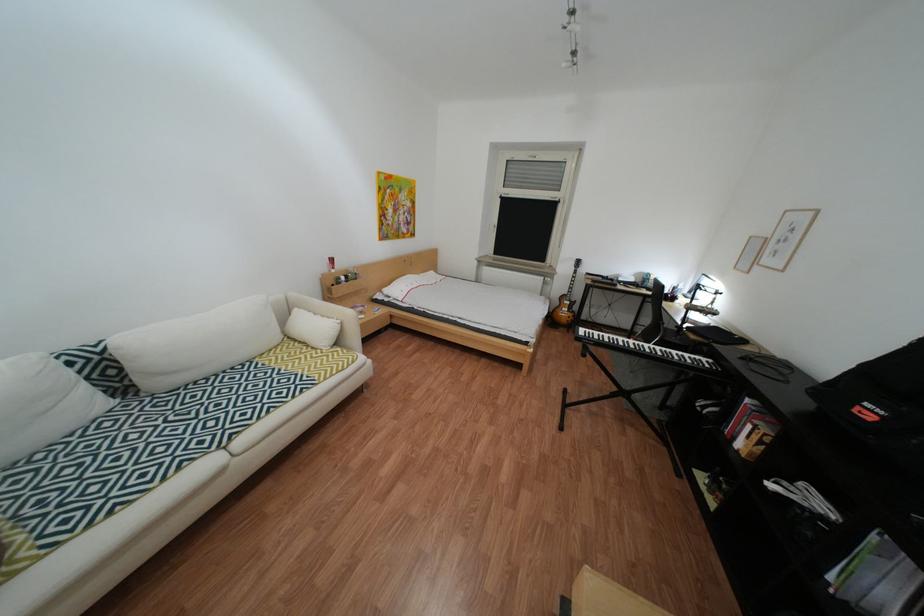
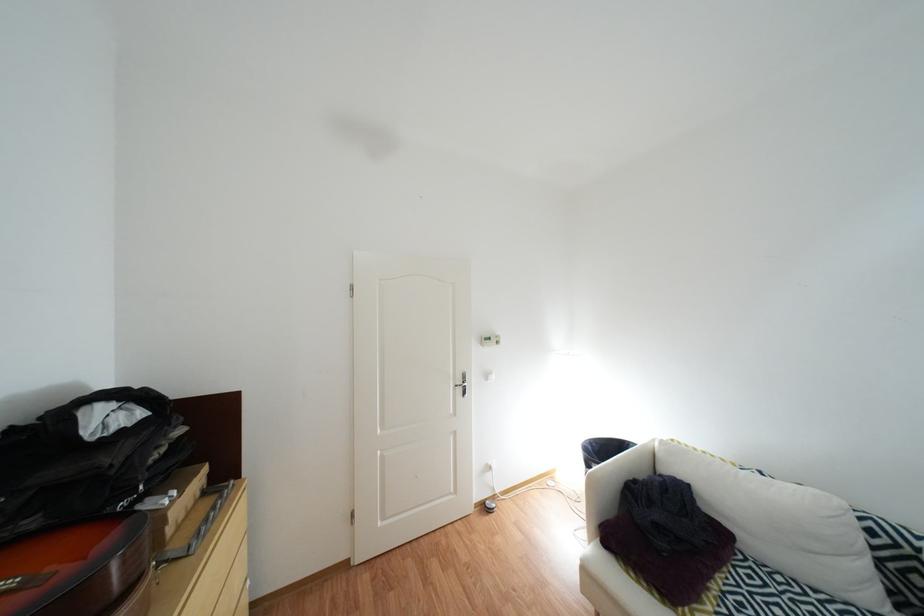
In the second image, find the point that corresponds to (55,469) in the first image.

(782, 586)